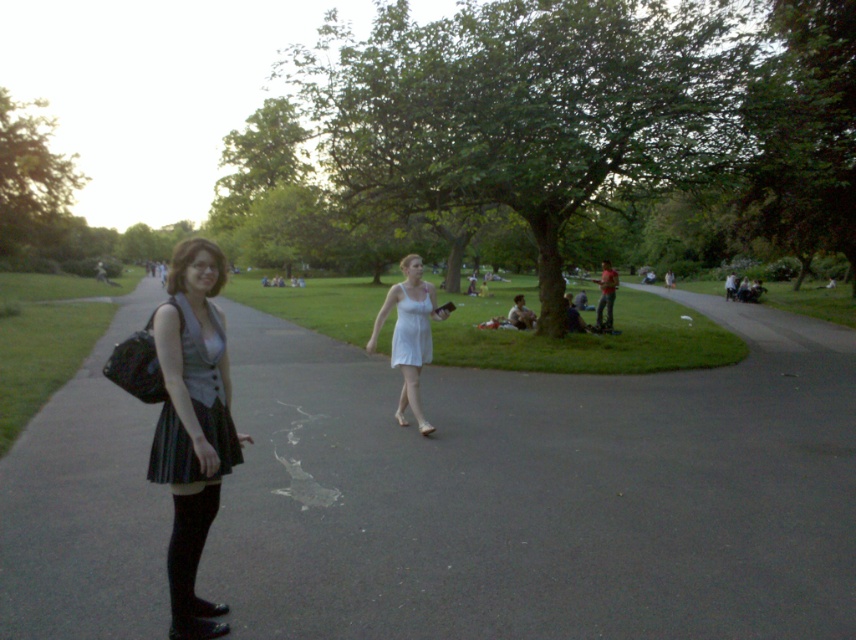
Between point (402, 344) and point (602, 284), which one is positioned in front?

Point (402, 344)

Where is `white satin dress at center`? white satin dress at center is located at coordinates (411, 330).

Where is `white satin dress at center`? The image size is (856, 640). white satin dress at center is located at coordinates (411, 330).

Does point (646, 490) come farther from viewer compared to point (607, 282)?

No, it is not.

Can you confirm if black asphalt pavement at lower left is positioned to the right of green fabric jacket at center?

In fact, black asphalt pavement at lower left is to the left of green fabric jacket at center.

Who is more forward, (723, 620) or (607, 269)?

Point (723, 620)

The image size is (856, 640). I want to click on black asphalt pavement at lower left, so click(541, 493).

Is smooth asphalt path at right wider than green fabric jacket at center?

Yes, smooth asphalt path at right is wider than green fabric jacket at center.

Can you confirm if smooth asphalt path at right is shorter than green fabric jacket at center?

No.

I want to click on smooth asphalt path at right, so 761,321.

The width and height of the screenshot is (856, 640). In order to click on smooth asphalt path at right in this screenshot , I will do `click(761, 321)`.